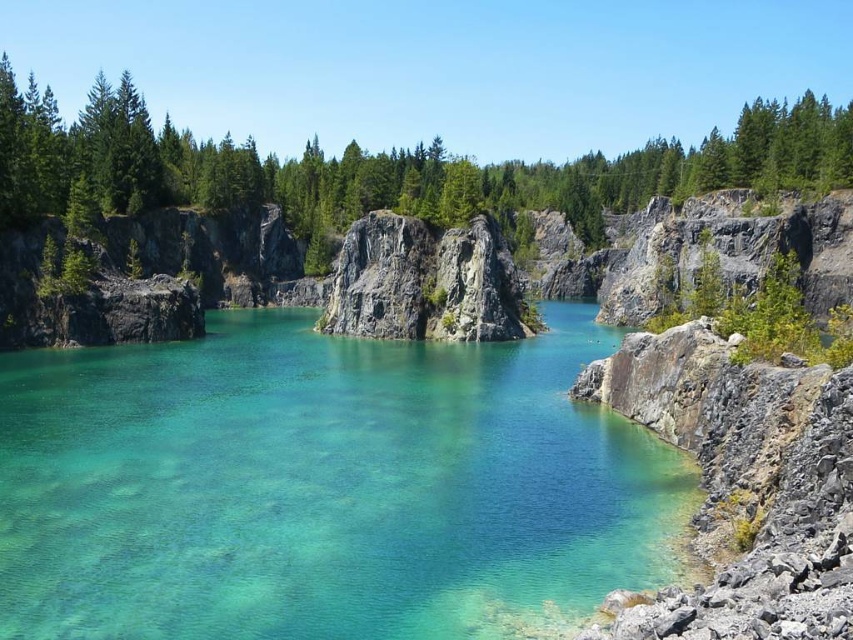
Does point (518, 468) come behind point (459, 326)?

No, (518, 468) is in front of (459, 326).

Between clear glassy water at center and rough granite rock at center, which one has more height?

Standing taller between the two is rough granite rock at center.

Where is `clear glassy water at center`? clear glassy water at center is located at coordinates (325, 486).

Does point (190, 157) come in front of point (508, 260)?

No, (190, 157) is further to viewer.

Where is `green matte rock at center`? The height and width of the screenshot is (640, 853). green matte rock at center is located at coordinates (384, 168).

Where is `green matte rock at center`? The height and width of the screenshot is (640, 853). green matte rock at center is located at coordinates (384, 168).

Which is above, clear glassy water at center or green matte rock at center?

green matte rock at center

Does point (567, 349) come behind point (236, 163)?

No, (567, 349) is closer to viewer.

You are a GUI agent. You are given a task and a screenshot of the screen. Output one action in this format:
    pyautogui.click(x=<x>, y=<y>)
    Task: Click on the clear glassy water at center
    
    Given the screenshot: What is the action you would take?
    pyautogui.click(x=325, y=486)